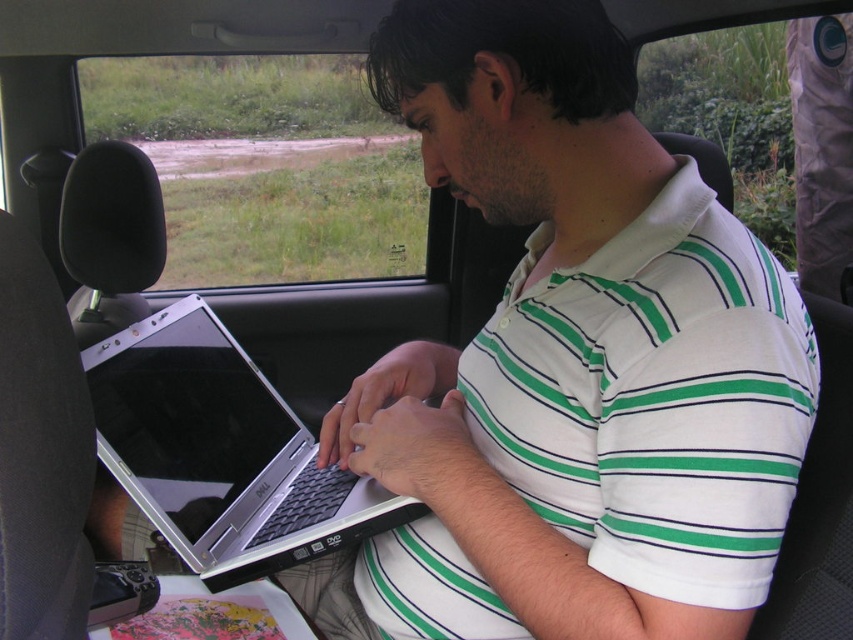
Which of these two, white striped polo shirt at center or silver metallic laptop at center, stands taller?

white striped polo shirt at center is taller.

Is white striped polo shirt at center smaller than silver metallic laptop at center?

Incorrect, white striped polo shirt at center is not smaller in size than silver metallic laptop at center.

Who is more forward, [637,500] or [412,499]?

Point [637,500]

The width and height of the screenshot is (853, 640). Find the location of `white striped polo shirt at center`. white striped polo shirt at center is located at coordinates (653, 397).